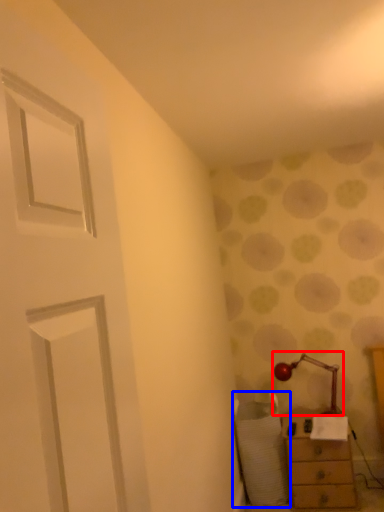
Question: Which object appears closest to the camera in this image, table lamp (highlighted by a red box) or swivel chair (highlighted by a blue box)?

Choices:
 (A) table lamp
 (B) swivel chair

Answer: (B)